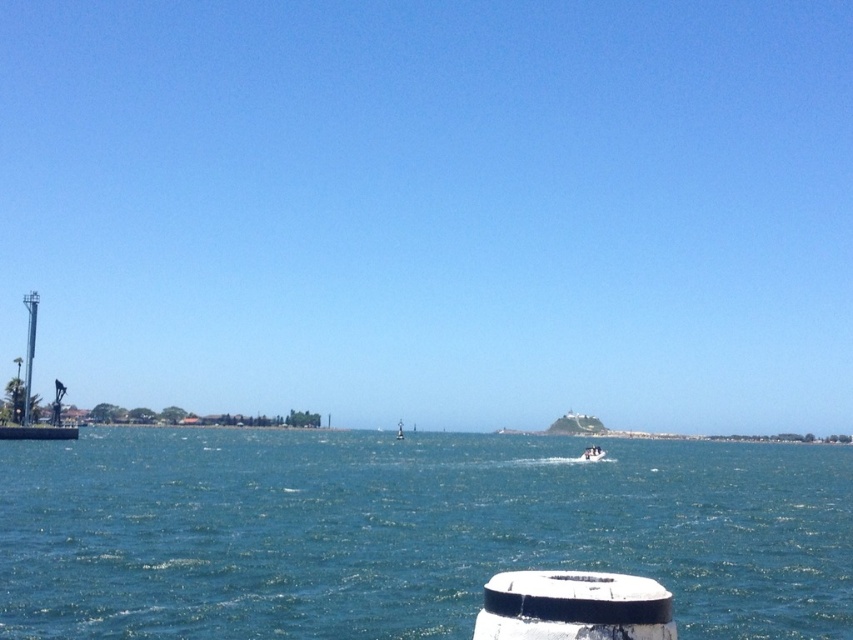
Does blue water at center appear on the left side of white matte boat at center?

In fact, blue water at center is to the right of white matte boat at center.

Can you confirm if blue water at center is shorter than white matte boat at center?

In fact, blue water at center may be taller than white matte boat at center.

Between point (296, 477) and point (590, 445), which one is positioned behind?

The point (590, 445) is more distant.

Find the location of a particular element. Image resolution: width=853 pixels, height=640 pixels. blue water at center is located at coordinates (407, 532).

Is point (601, 456) closer to camera compared to point (399, 432)?

Yes, it is.

From the picture: Does white matte boat at center appear under white glossy boat at center?

Actually, white matte boat at center is above white glossy boat at center.

Based on the photo, measure the distance between point (x=593, y=458) and camera.

Point (x=593, y=458) and camera are 114.28 meters apart.

I want to click on white matte boat at center, so click(592, 452).

Does blue water at center have a larger size compared to white glossy boat at center?

Indeed, blue water at center has a larger size compared to white glossy boat at center.

Who is higher up, blue water at center or white glossy boat at center?

Positioned higher is blue water at center.

Where is `blue water at center`? blue water at center is located at coordinates (407, 532).

I want to click on blue water at center, so click(x=407, y=532).